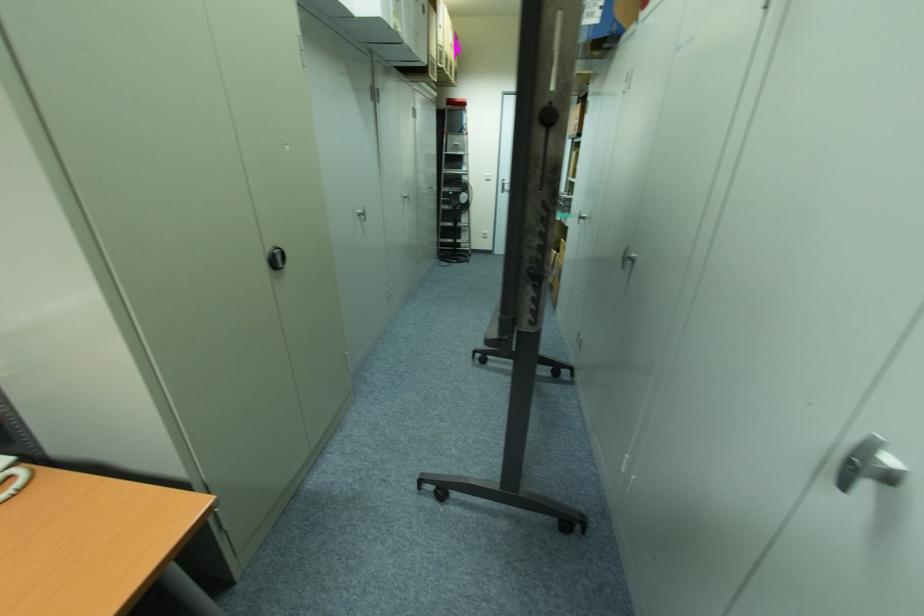
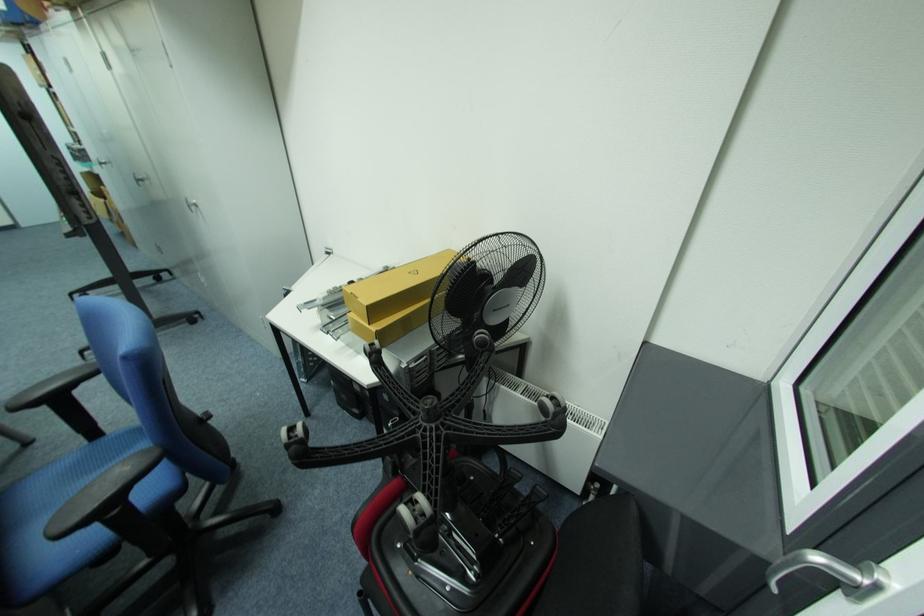
The point at (636, 254) is marked in the first image. Where is the corresponding point in the second image?

(141, 179)